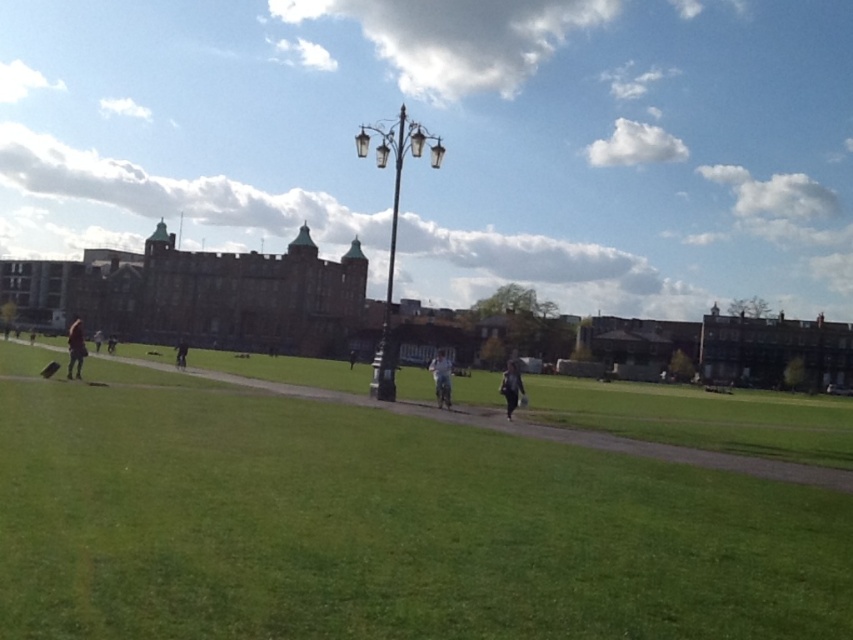
Who is more forward, (114, 342) or (97, 346)?

Point (97, 346)

The width and height of the screenshot is (853, 640). What do you see at coordinates (111, 342) in the screenshot? I see `dark blue jeans at lower left` at bounding box center [111, 342].

Which is in front, point (109, 339) or point (96, 348)?

Point (109, 339) is in front.

Locate an element on the screen. dark blue jeans at lower left is located at coordinates (111, 342).

Can you confirm if matte brick building at center is wider than white fabric person at center?

Yes.

Between matte brick building at center and white fabric person at center, which one is positioned higher?

matte brick building at center is above.

Does point (752, 284) come closer to viewer compared to point (444, 360)?

No, it is not.

You are a GUI agent. You are given a task and a screenshot of the screen. Output one action in this format:
    pyautogui.click(x=<x>, y=<y>)
    Task: Click on the matte brick building at center
    This screenshot has width=853, height=640.
    Given the screenshot: What is the action you would take?
    pyautogui.click(x=450, y=140)

Which is more to the left, red wool coat at left or dark gray pants at left?

Positioned to the left is dark gray pants at left.

Between red wool coat at left and dark gray pants at left, which one has less height?

dark gray pants at left is shorter.

Between point (73, 340) and point (97, 348), which one is positioned behind?

The point (97, 348) is more distant.

I want to click on red wool coat at left, so (x=74, y=348).